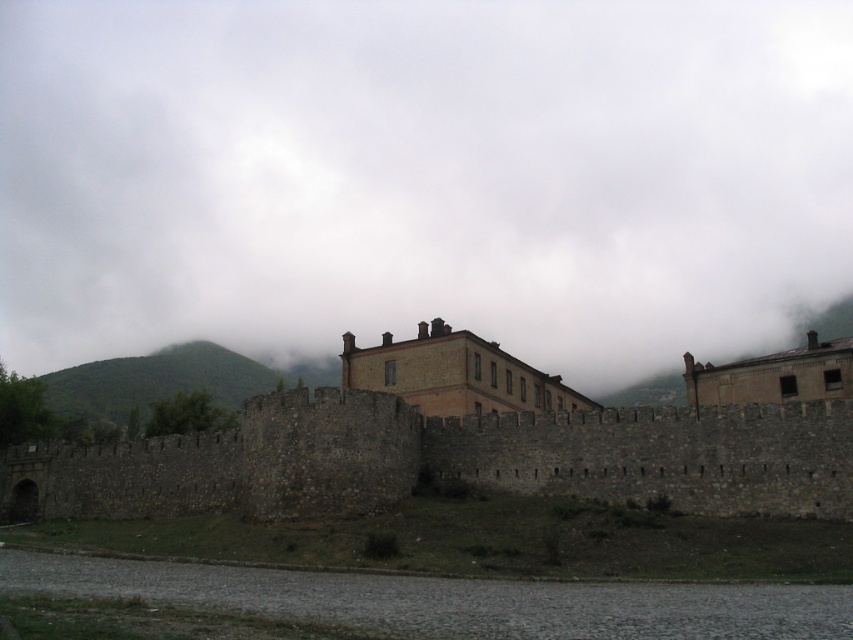
You are an architect examining the fortress layout. You notice the white fluffy cloud at upper center and the stone wall at center. Which object is closer to your viewpoint?

The white fluffy cloud at upper center is closer to your viewpoint because the stone wall at center is behind it.

You are an architect examining the fortress layout. You notice the white fluffy cloud at upper center and the stone wall at center. Which object is positioned higher in the sky?

The white fluffy cloud at upper center is located above the stone wall at center, so it is positioned higher in the sky.

You are an architect examining the fortress layout. You notice the white fluffy cloud at upper center and the stone wall at center. Based on their positions, which object is closer to the left side of the image?

The white fluffy cloud at upper center is closer to the left side of the image because it is positioned to the left of the stone wall at center.